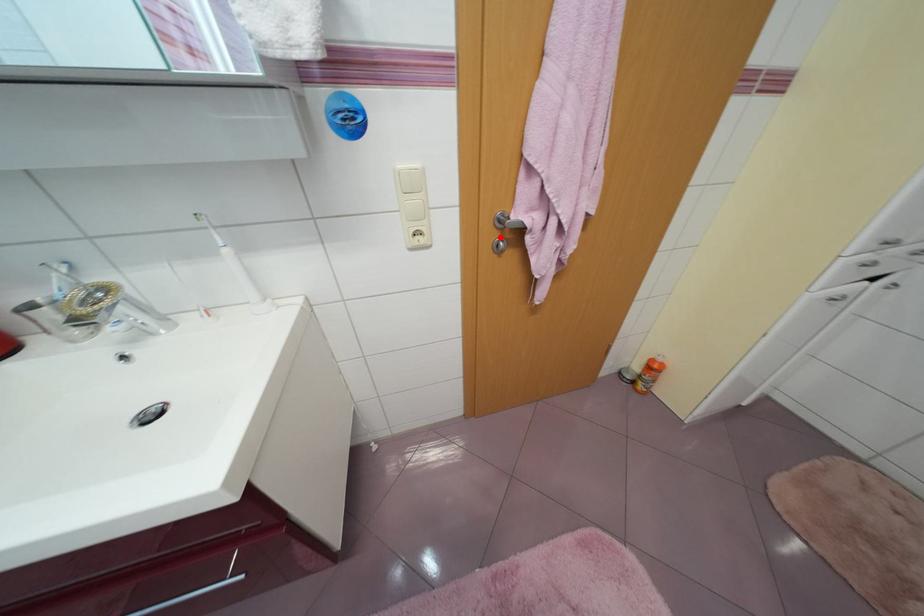
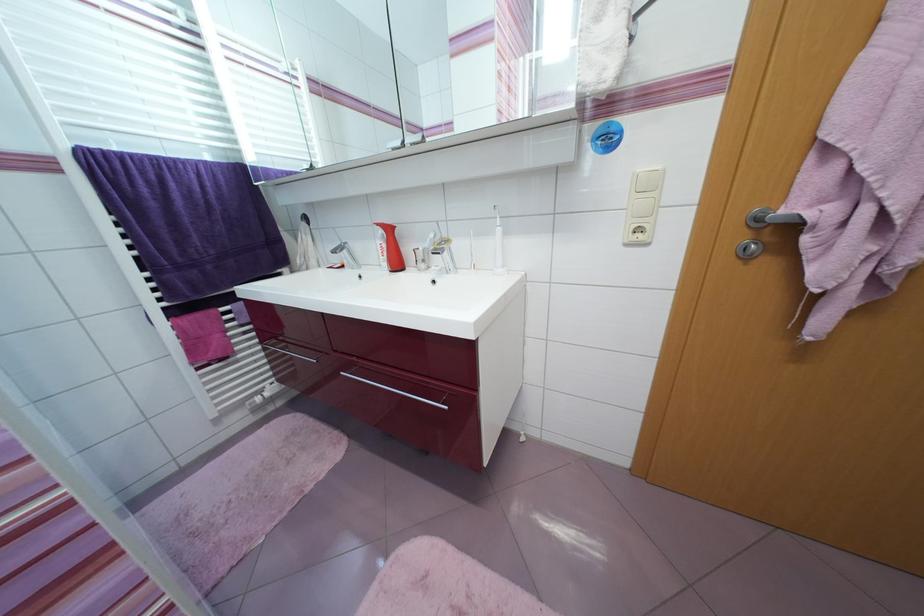
Where in the second image is the point corresponding to the highlighted location from the first image?

(748, 238)